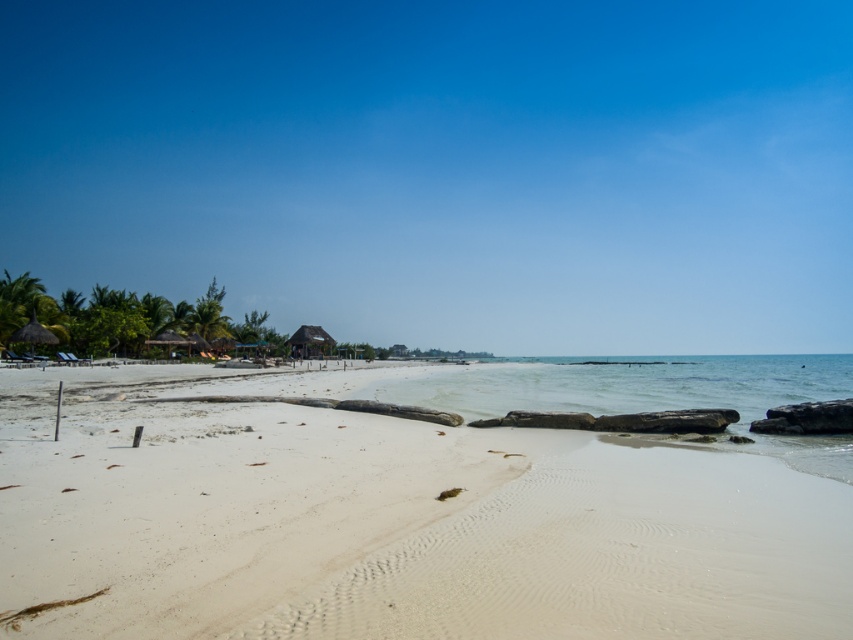
You are planning to set up a small tent for a beach picnic. You have two options for locations based on the objects in the scene. The first option is near the clear water at lower right, and the second is near the thatched roof hut at center. Considering the size of the areas, which location would provide more space for your tent?

The clear water at lower right is larger in size than the thatched roof hut at center, so setting up the tent near the clear water at lower right would provide more space for your tent.

You are standing on the white sand beach at center and want to reach the thatched roof hut at center. In which direction should you walk to get there?

The white sand beach at center is positioned on the right side of thatched roof hut at center, so you should walk to the left to reach the thatched roof hut at center.